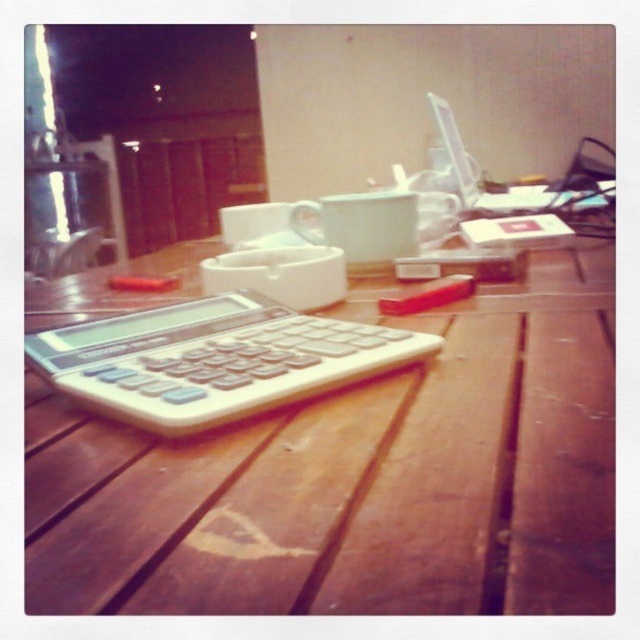
Question: Is wooden table at center to the right of white plastic calculator at center from the viewer's perspective?

Choices:
 (A) yes
 (B) no

Answer: (A)

Question: Among these objects, which one is nearest to the camera?

Choices:
 (A) wooden table at center
 (B) white plastic calculator at center

Answer: (A)

Question: Among these objects, which one is farthest from the camera?

Choices:
 (A) white plastic calculator at center
 (B) wooden table at center

Answer: (A)

Question: Is wooden table at center below white plastic calculator at center?

Choices:
 (A) no
 (B) yes

Answer: (A)

Question: From the image, what is the correct spatial relationship of wooden table at center in relation to white plastic calculator at center?

Choices:
 (A) below
 (B) above

Answer: (B)

Question: Among these objects, which one is farthest from the camera?

Choices:
 (A) white plastic calculator at center
 (B) wooden table at center

Answer: (A)